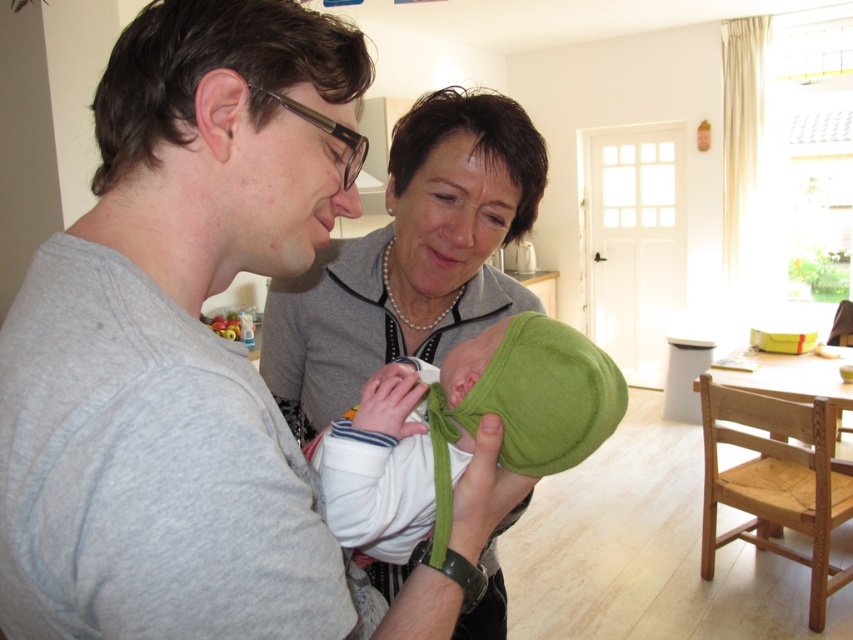
Question: Can you confirm if gray cotton shirt at center is positioned to the left of green fleece hat at center?

Choices:
 (A) yes
 (B) no

Answer: (A)

Question: Which point appears farthest from the camera in this image?

Choices:
 (A) (383, 380)
 (B) (125, 580)
 (C) (428, 237)

Answer: (C)

Question: Observing the image, what is the correct spatial positioning of gray cotton shirt at center in reference to green fleece hat at center?

Choices:
 (A) right
 (B) left

Answer: (B)

Question: Can you confirm if gray cotton shirt at center is thinner than green fleece hat at center?

Choices:
 (A) yes
 (B) no

Answer: (B)

Question: Estimate the real-world distances between objects in this image. Which object is closer to the green fleece hat at center?

Choices:
 (A) gray cotton shirt at center
 (B) pearl necklace at upper center

Answer: (A)

Question: Which object appears farthest from the camera in this image?

Choices:
 (A) pearl necklace at upper center
 (B) green fleece hat at center

Answer: (A)